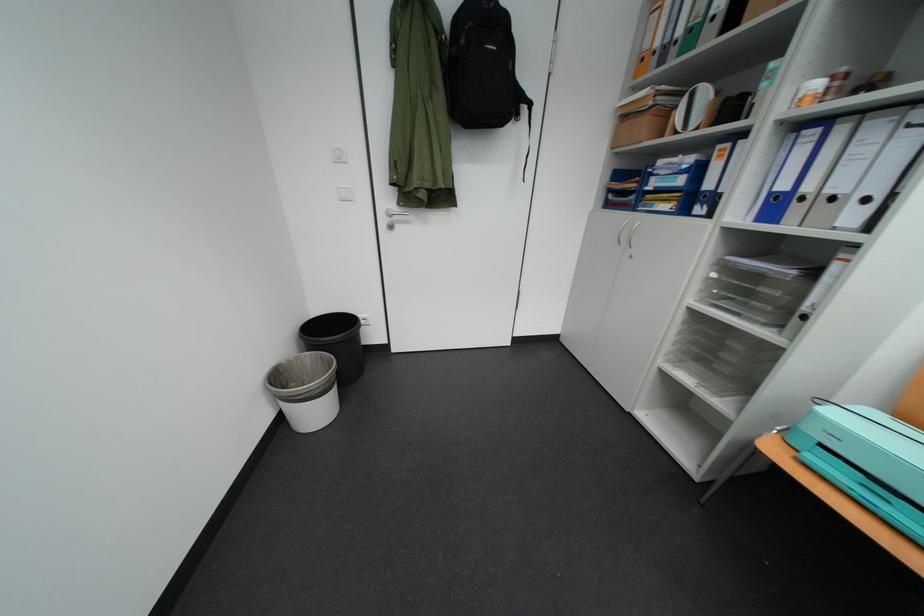
Which object does [305,390] point to?

It corresponds to the black trash can in the image.